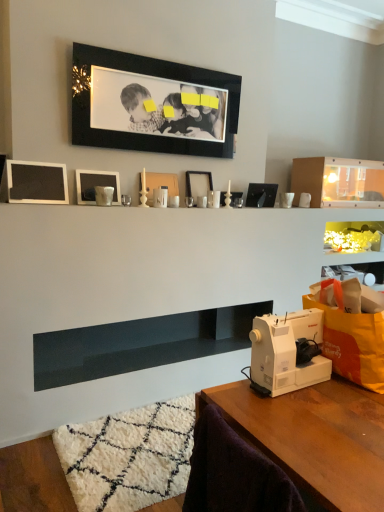
What do you see at coordinates (152, 104) in the screenshot? The image size is (384, 512). I see `black matte picture frame at upper center, the 3th picture frame positioned from the right` at bounding box center [152, 104].

Based on the photo, what is the approximate width of matte black picture frame at center, which is the 1th picture frame from right to left?

matte black picture frame at center, which is the 1th picture frame from right to left, is 6.08 inches wide.

The width and height of the screenshot is (384, 512). In order to click on wooden table at lower right in this screenshot , I will do (x=314, y=438).

Where is `matte black picture frame at center, positioned as the 2th picture frame in right-to-left order`? matte black picture frame at center, positioned as the 2th picture frame in right-to-left order is located at coordinates (198, 184).

The height and width of the screenshot is (512, 384). What do you see at coordinates (140, 344) in the screenshot? I see `smooth dark blue shelf at center, the 2th shelf viewed from the top` at bounding box center [140, 344].

How much space does matte black frame at left, which is the 6th picture frame in right-to-left order, occupy horizontally?

matte black frame at left, which is the 6th picture frame in right-to-left order, is 10.43 centimeters wide.

Where is `matte black frame at left, which is the 6th picture frame in right-to-left order`? matte black frame at left, which is the 6th picture frame in right-to-left order is located at coordinates (37, 182).

I want to click on black matte picture frame at upper center, arranged as the fourth picture frame when viewed from the left, so pos(152,104).

Is point (90, 195) closer to camera compared to point (365, 378)?

No, it is not.

Which of these two, matte silver frame at upper center, placed as the second picture frame when sorted from left to right, or orange fabric shopping bag at right, stands taller?

With more height is orange fabric shopping bag at right.

From the image's perspective, does matte silver frame at upper center, placed as the second picture frame when sorted from left to right, appear higher than orange fabric shopping bag at right?

Indeed, from the image's perspective, matte silver frame at upper center, placed as the second picture frame when sorted from left to right, is shown above orange fabric shopping bag at right.

Relative to matte black picture frame at center, which is the 1th picture frame from right to left, is matte white picture frame at center, which appears as the 4th picture frame when viewed from the right, in front or behind?

Clearly, matte white picture frame at center, which appears as the 4th picture frame when viewed from the right, is in front of matte black picture frame at center, which is the 1th picture frame from right to left.

From a real-world perspective, which is physically below, matte white picture frame at center, placed as the 3th picture frame when sorted from left to right, or matte black picture frame at center, which is the 1th picture frame from right to left?

matte black picture frame at center, which is the 1th picture frame from right to left.

Is matte white picture frame at center, placed as the 3th picture frame when sorted from left to right, wider than matte black picture frame at center, which is counted as the sixth picture frame, starting from the left?

No.

Looking at the image, does matte white picture frame at center, placed as the 3th picture frame when sorted from left to right, seem bigger or smaller compared to matte black picture frame at center, which is the 1th picture frame from right to left?

Considering their sizes, matte white picture frame at center, placed as the 3th picture frame when sorted from left to right, takes up less space than matte black picture frame at center, which is the 1th picture frame from right to left.

From the image's perspective, count 4th picture frames upward from the wooden table at lower right and point to it. Please provide its 2D coordinates.

[(161, 184)]

From the image's perspective, between wooden table at lower right and matte white picture frame at center, placed as the 3th picture frame when sorted from left to right, who is located below?

From the image's view, wooden table at lower right is below.

Looking at this image, is wooden table at lower right positioned with its back to matte white picture frame at center, which appears as the 4th picture frame when viewed from the right?

That's not correct — wooden table at lower right is not looking away from matte white picture frame at center, which appears as the 4th picture frame when viewed from the right.

From a real-world perspective, is wooden table at lower right on matte white picture frame at center, which appears as the 4th picture frame when viewed from the right?

Actually, wooden table at lower right is physically below matte white picture frame at center, which appears as the 4th picture frame when viewed from the right, in the real world.

Would you say orange fabric shopping bag at right is outside transparent plastic shelf at upper center, the 2th shelf viewed from the left?

Yes, orange fabric shopping bag at right is not within transparent plastic shelf at upper center, the 2th shelf viewed from the left.

Where is `the 2nd shelf behind when counting from the orange fabric shopping bag at right`? the 2nd shelf behind when counting from the orange fabric shopping bag at right is located at coordinates (338, 182).

Between orange fabric shopping bag at right and transparent plastic shelf at upper center, which is counted as the first shelf, starting from the right, which one has larger size?

transparent plastic shelf at upper center, which is counted as the first shelf, starting from the right, is bigger.

Is orange fabric shopping bag at right further to the viewer compared to transparent plastic shelf at upper center, the 2th shelf when ordered from bottom to top?

No, it is in front of transparent plastic shelf at upper center, the 2th shelf when ordered from bottom to top.

Is point (101, 174) closer or farther from the camera than point (340, 188)?

Point (101, 174) is positioned closer to the camera compared to point (340, 188).

Is matte silver frame at upper center, which appears as the 5th picture frame when viewed from the right, shorter than transparent plastic shelf at upper center, marked as the 1th shelf in a top-to-bottom arrangement?

Yes, matte silver frame at upper center, which appears as the 5th picture frame when viewed from the right, is shorter than transparent plastic shelf at upper center, marked as the 1th shelf in a top-to-bottom arrangement.

Considering their positions, is matte silver frame at upper center, which appears as the 5th picture frame when viewed from the right, located in front of or behind transparent plastic shelf at upper center, the 2th shelf when ordered from bottom to top?

matte silver frame at upper center, which appears as the 5th picture frame when viewed from the right, is positioned closer to the viewer than transparent plastic shelf at upper center, the 2th shelf when ordered from bottom to top.

Is matte silver frame at upper center, which appears as the 5th picture frame when viewed from the right, bigger than transparent plastic shelf at upper center, the 2th shelf viewed from the left?

No, matte silver frame at upper center, which appears as the 5th picture frame when viewed from the right, is not bigger than transparent plastic shelf at upper center, the 2th shelf viewed from the left.

Does matte black picture frame at center, which is the 1th picture frame from right to left, have a greater height compared to matte white picture frame at center, placed as the 3th picture frame when sorted from left to right?

No, matte black picture frame at center, which is the 1th picture frame from right to left, is not taller than matte white picture frame at center, placed as the 3th picture frame when sorted from left to right.

Is matte black picture frame at center, which is the 1th picture frame from right to left, far from matte white picture frame at center, placed as the 3th picture frame when sorted from left to right?

No, matte black picture frame at center, which is the 1th picture frame from right to left, is not far away from matte white picture frame at center, placed as the 3th picture frame when sorted from left to right.

From the image's perspective, which picture frame is the 1st one above the matte black picture frame at center, which is the 1th picture frame from right to left? Please provide its 2D coordinates.

[(161, 184)]

From a real-world perspective, does matte black picture frame at center, which is counted as the sixth picture frame, starting from the left, sit lower than matte white picture frame at center, placed as the 3th picture frame when sorted from left to right?

Yes, from a real-world perspective, matte black picture frame at center, which is counted as the sixth picture frame, starting from the left, is beneath matte white picture frame at center, placed as the 3th picture frame when sorted from left to right.

Is white plastic sewing machine at lower right positioned beyond the bounds of matte black picture frame at center, which is counted as the sixth picture frame, starting from the left?

Indeed, white plastic sewing machine at lower right is completely outside matte black picture frame at center, which is counted as the sixth picture frame, starting from the left.

Considering the relative sizes of white plastic sewing machine at lower right and matte black picture frame at center, which is the 1th picture frame from right to left, in the image provided, is white plastic sewing machine at lower right taller than matte black picture frame at center, which is the 1th picture frame from right to left,?

Correct, white plastic sewing machine at lower right is much taller as matte black picture frame at center, which is the 1th picture frame from right to left.

How distant is white plastic sewing machine at lower right from matte black picture frame at center, which is counted as the sixth picture frame, starting from the left?

white plastic sewing machine at lower right and matte black picture frame at center, which is counted as the sixth picture frame, starting from the left, are 1.58 meters apart.

Can you confirm if white plastic sewing machine at lower right is bigger than matte black picture frame at center, which is the 1th picture frame from right to left?

Yes.

The width and height of the screenshot is (384, 512). Find the location of `the 2nd picture frame located above the orange fabric shopping bag at right (from a real-world perspective)`. the 2nd picture frame located above the orange fabric shopping bag at right (from a real-world perspective) is located at coordinates (96, 185).

This screenshot has width=384, height=512. I want to click on the 2nd picture frame behind when counting from the matte white picture frame at center, which appears as the 4th picture frame when viewed from the right, so click(x=261, y=195).

Estimate the real-world distances between objects in this image. Which object is closer to transparent plastic shelf at upper center, the 2th shelf when ordered from bottom to top, matte white picture frame at center, which appears as the 4th picture frame when viewed from the right, or wooden table at lower right?

matte white picture frame at center, which appears as the 4th picture frame when viewed from the right, is closer to transparent plastic shelf at upper center, the 2th shelf when ordered from bottom to top.

Considering their positions, is matte black frame at left, the 1th picture frame in the left-to-right sequence, positioned further to black matte picture frame at upper center, the 3th picture frame positioned from the right, than wooden table at lower right?

wooden table at lower right is further to black matte picture frame at upper center, the 3th picture frame positioned from the right.

Estimate the real-world distances between objects in this image. Which object is further from orange fabric shopping bag at right, matte black frame at left, which is the 6th picture frame in right-to-left order, or white plastic sewing machine at lower right?

Among the two, matte black frame at left, which is the 6th picture frame in right-to-left order, is located further to orange fabric shopping bag at right.

Based on their spatial positions, is matte black picture frame at center, marked as the fifth picture frame in a left-to-right arrangement, or matte silver frame at upper center, placed as the second picture frame when sorted from left to right, further from white plastic sewing machine at lower right?

Among the two, matte black picture frame at center, marked as the fifth picture frame in a left-to-right arrangement, is located further to white plastic sewing machine at lower right.

When comparing their distances from black matte picture frame at upper center, arranged as the fourth picture frame when viewed from the left, does orange fabric shopping bag at right or matte black frame at left, the 1th picture frame in the left-to-right sequence, seem further?

orange fabric shopping bag at right is further to black matte picture frame at upper center, arranged as the fourth picture frame when viewed from the left.

Considering their positions, is matte white picture frame at center, which appears as the 4th picture frame when viewed from the right, positioned further to black matte picture frame at upper center, the 3th picture frame positioned from the right, than wooden table at lower right?

The object further to black matte picture frame at upper center, the 3th picture frame positioned from the right, is wooden table at lower right.

Considering their positions, is wooden table at lower right positioned closer to black matte picture frame at upper center, arranged as the fourth picture frame when viewed from the left, than matte black picture frame at center, which is counted as the sixth picture frame, starting from the left?

Based on the image, matte black picture frame at center, which is counted as the sixth picture frame, starting from the left, appears to be nearer to black matte picture frame at upper center, arranged as the fourth picture frame when viewed from the left.

From the image, which object appears to be farther from orange fabric shopping bag at right, transparent plastic shelf at upper center, which is counted as the first shelf, starting from the right, or matte black frame at left, which is the 6th picture frame in right-to-left order?

transparent plastic shelf at upper center, which is counted as the first shelf, starting from the right, is further to orange fabric shopping bag at right.

The width and height of the screenshot is (384, 512). Find the location of `shelf between white plastic sewing machine at lower right and matte white picture frame at center, which appears as the 4th picture frame when viewed from the right, from front to back`. shelf between white plastic sewing machine at lower right and matte white picture frame at center, which appears as the 4th picture frame when viewed from the right, from front to back is located at coordinates (140, 344).

Where is `sewing machine between matte black frame at left, the 1th picture frame in the left-to-right sequence, and matte black picture frame at center, which is counted as the sixth picture frame, starting from the left, from left to right`? sewing machine between matte black frame at left, the 1th picture frame in the left-to-right sequence, and matte black picture frame at center, which is counted as the sixth picture frame, starting from the left, from left to right is located at coordinates (287, 351).

Locate an element on the screen. sewing machine between orange fabric shopping bag at right and transparent plastic shelf at upper center, the 2th shelf viewed from the left, along the z-axis is located at coordinates (287, 351).

What are the coordinates of `shopping bag between wooden table at lower right and matte silver frame at upper center, placed as the second picture frame when sorted from left to right, along the z-axis` in the screenshot? It's located at (353, 344).